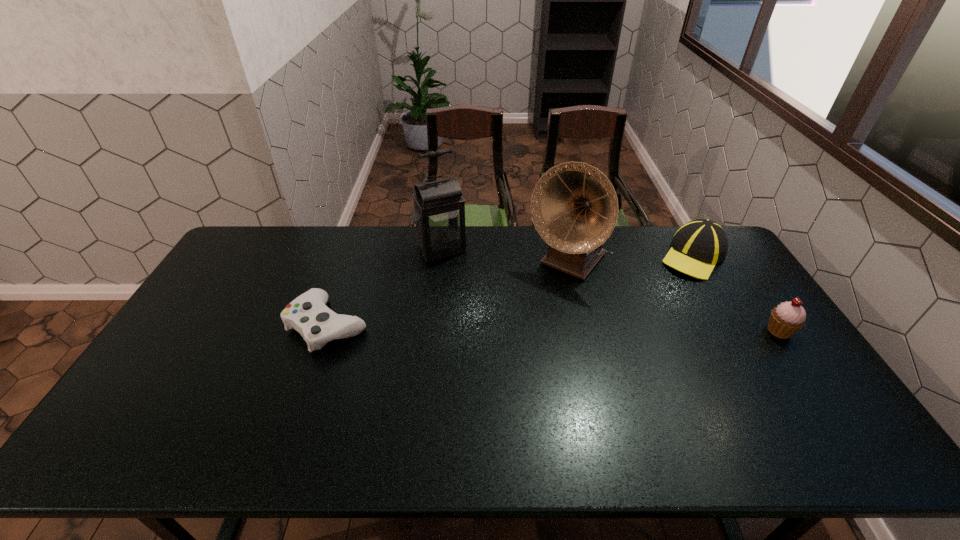
Identify the location of vacant area that lies between the cupcake and the lantern. The width and height of the screenshot is (960, 540). (611, 289).

In order to click on vacant space that is in between the baseball cap and the third object from right to left in this screenshot , I will do `click(631, 259)`.

Locate an element on the screen. The height and width of the screenshot is (540, 960). free space between the phonograph record and the lantern is located at coordinates (505, 255).

Where is `blank region between the third object from left to right and the cupcake`? This screenshot has width=960, height=540. blank region between the third object from left to right and the cupcake is located at coordinates (673, 296).

Find the location of `free space between the leftmost object and the second object from left to right`. free space between the leftmost object and the second object from left to right is located at coordinates (385, 287).

The image size is (960, 540). What are the coordinates of `free space between the baseball cap and the leftmost object` in the screenshot? It's located at (511, 291).

Where is `free space between the third object from left to right and the shortest object`? free space between the third object from left to right and the shortest object is located at coordinates (447, 293).

You are a GUI agent. You are given a task and a screenshot of the screen. Output one action in this format:
    pyautogui.click(x=<x>, y=<y>)
    Task: Click on the object that stands as the third closest to the cupcake
    
    Given the screenshot: What is the action you would take?
    pyautogui.click(x=439, y=209)

Where is `the fourth closest object to the shortest object`? This screenshot has width=960, height=540. the fourth closest object to the shortest object is located at coordinates (786, 319).

Locate an element on the screen. This screenshot has height=540, width=960. vacant area in the image that satisfies the following two spatial constraints: 1. on the back side of the baseball cap; 2. on the left side of the third object from right to left is located at coordinates (566, 256).